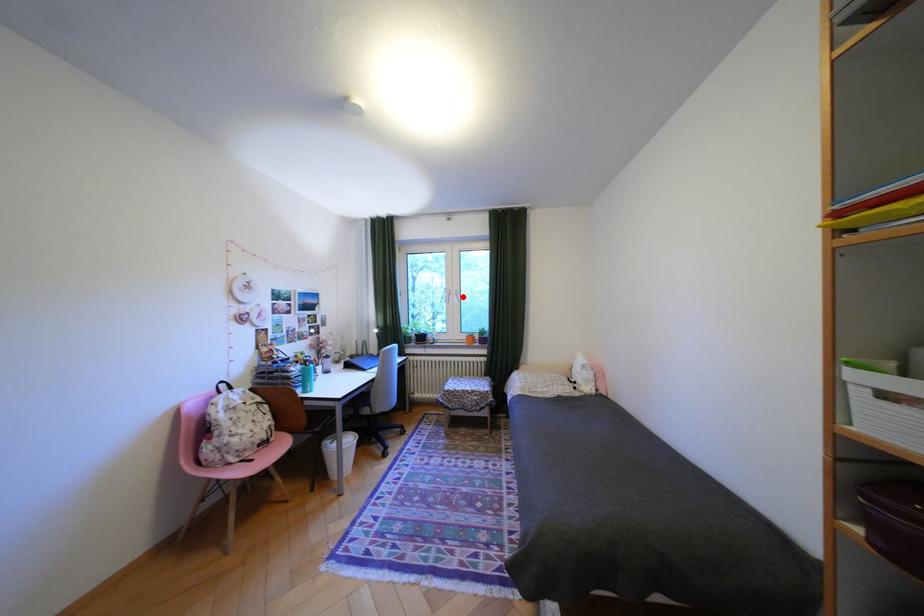
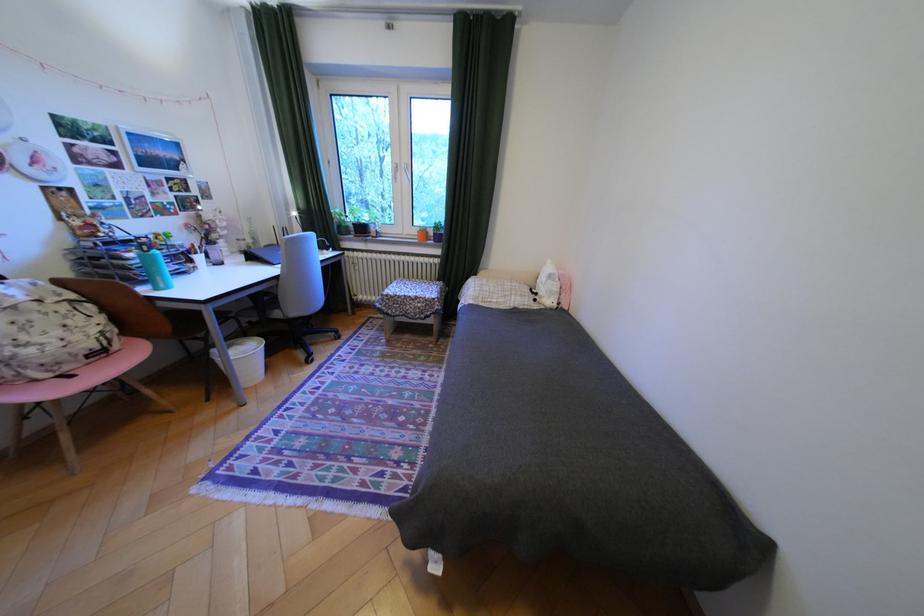
In the second image, find the point that corresponds to the highlighted location in the first image.

(410, 174)